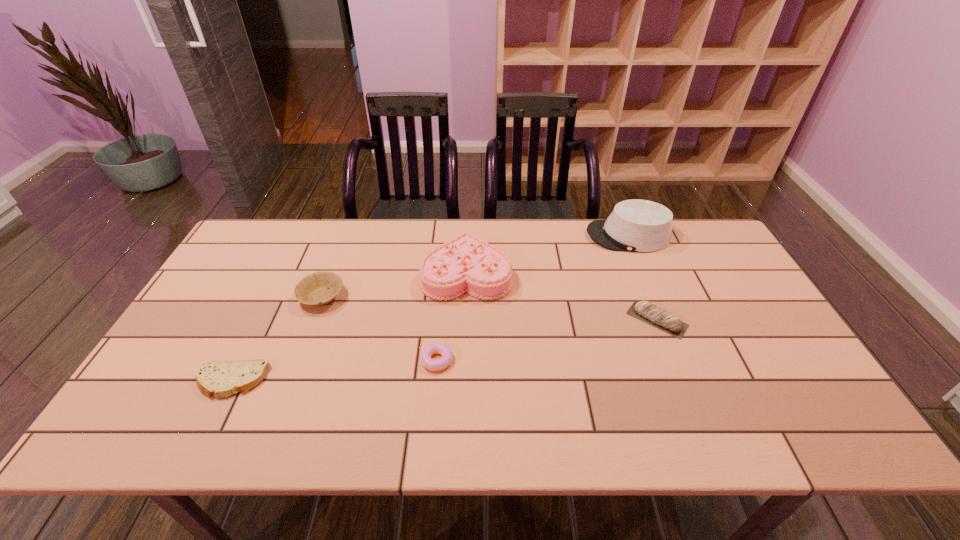
Image resolution: width=960 pixels, height=540 pixels. Find the location of `vacant space located on the front-facing side of the hat`. vacant space located on the front-facing side of the hat is located at coordinates pyautogui.click(x=554, y=235).

Find the location of `vacant position located on the left of the cake`. vacant position located on the left of the cake is located at coordinates (350, 273).

Where is `vacant space located on the front of the bowl`? vacant space located on the front of the bowl is located at coordinates (276, 418).

The height and width of the screenshot is (540, 960). I want to click on free space located on the front of the taller pita bread, so click(x=702, y=431).

Where is `free space located 0.050m on the right of the doughnut`? The image size is (960, 540). free space located 0.050m on the right of the doughnut is located at coordinates (473, 360).

The width and height of the screenshot is (960, 540). Identify the location of vacant area situated on the left of the left pita bread. (160, 381).

Find the location of a particular element. This screenshot has width=960, height=540. hat present at the far edge is located at coordinates (635, 225).

I want to click on cake that is positioned at the far edge, so click(465, 264).

Find the location of a particular element. The height and width of the screenshot is (540, 960). object at the left edge is located at coordinates (215, 378).

You are a GUI agent. You are given a task and a screenshot of the screen. Output one action in this format:
    pyautogui.click(x=<x>, y=<y>)
    Task: Click on the object located in the right edge section of the desktop
    
    Given the screenshot: What is the action you would take?
    pyautogui.click(x=635, y=225)